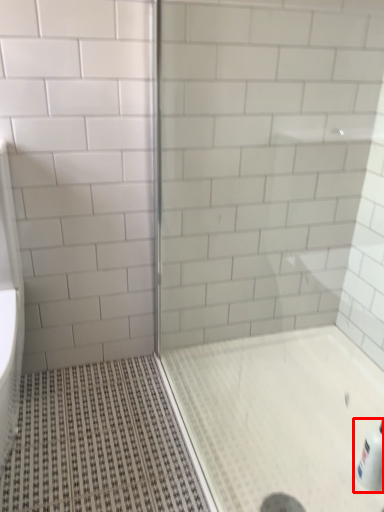
Question: From the image's perspective, where is bottle (annotated by the red box) located in relation to screen door in the image?

Choices:
 (A) above
 (B) below

Answer: (B)